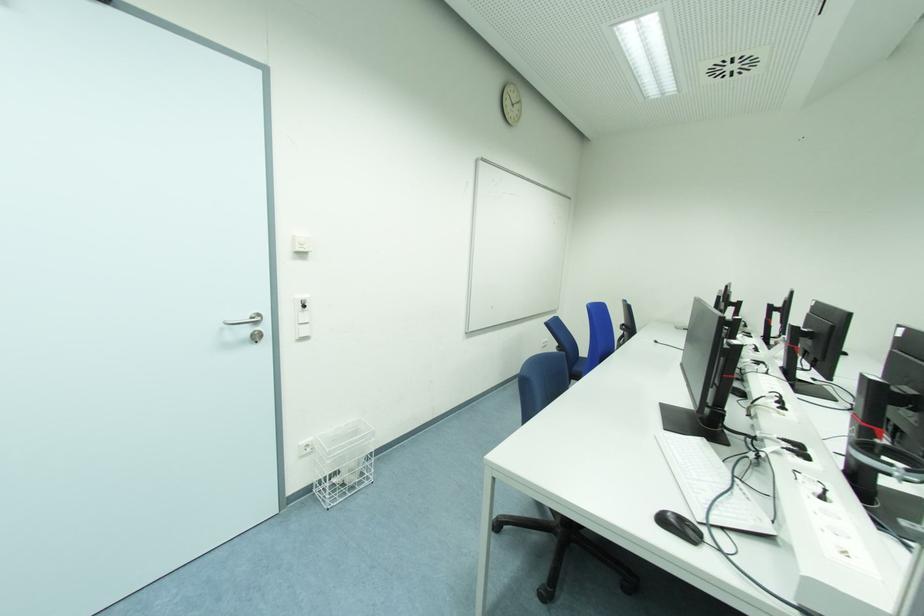
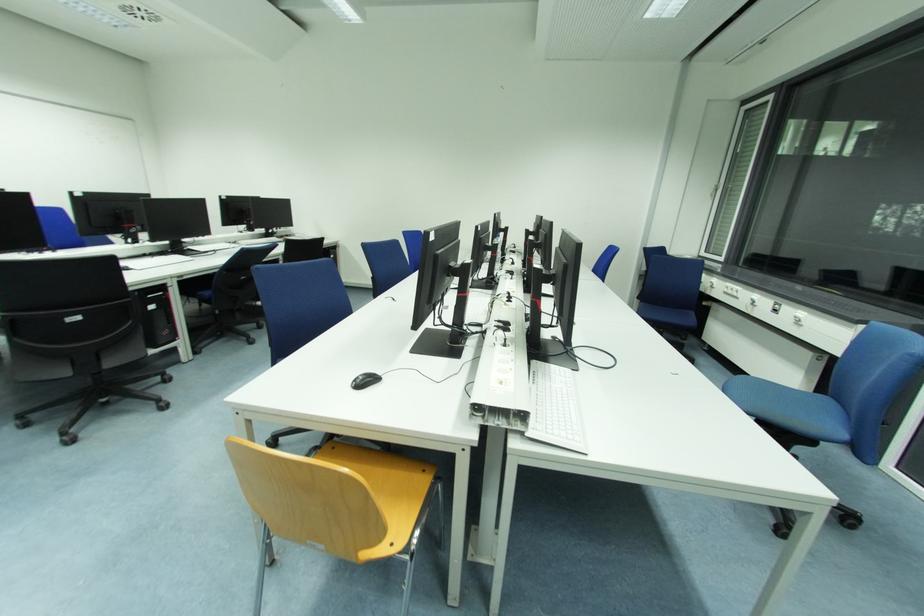
Based on the photo, what movement of the cameraman would produce the second image?

The movement direction of the cameraman is right, backward.